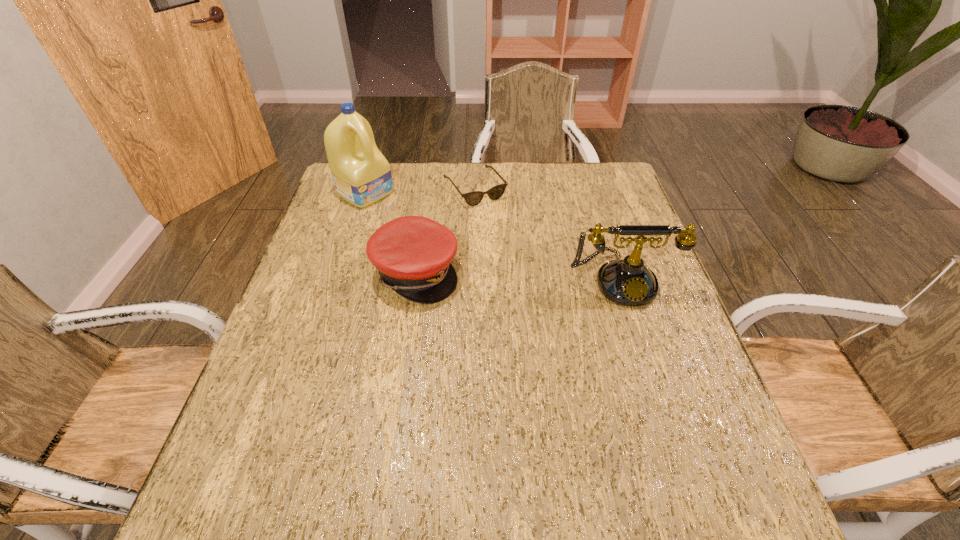
Locate an element on the screen. The width and height of the screenshot is (960, 540). cap is located at coordinates (413, 254).

This screenshot has height=540, width=960. In order to click on the rightmost object in this screenshot , I will do `click(628, 282)`.

This screenshot has width=960, height=540. Find the location of `telephone`. telephone is located at coordinates (628, 282).

Image resolution: width=960 pixels, height=540 pixels. I want to click on sunglasses, so click(x=473, y=198).

Where is `the tallest object`? This screenshot has height=540, width=960. the tallest object is located at coordinates (362, 176).

Where is `vacant space positioned 0.230m on the front-facing side of the cap`? Image resolution: width=960 pixels, height=540 pixels. vacant space positioned 0.230m on the front-facing side of the cap is located at coordinates (548, 272).

This screenshot has height=540, width=960. I want to click on vacant region located on the dial of the telephone, so click(x=671, y=438).

I want to click on vacant space located on the front lenses of the sunglasses, so click(556, 290).

Where is `vacant space situated on the front lenses of the sunglasses`? vacant space situated on the front lenses of the sunglasses is located at coordinates (520, 246).

The width and height of the screenshot is (960, 540). Find the location of `free region located on the front lenses of the sunglasses`. free region located on the front lenses of the sunglasses is located at coordinates (520, 246).